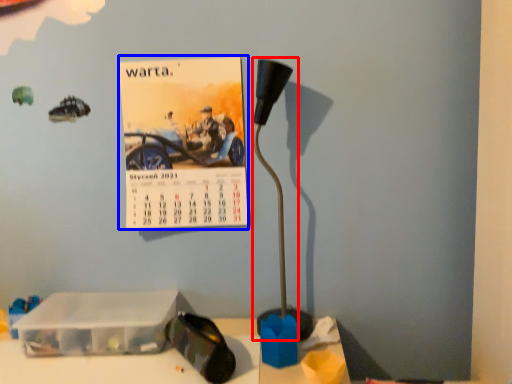
Question: Which of the following is the farthest to the observer, lamp (highlighted by a red box) or postcard (highlighted by a blue box)?

Choices:
 (A) lamp
 (B) postcard

Answer: (B)